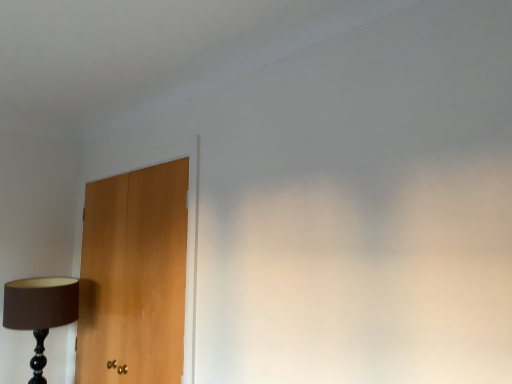
This screenshot has width=512, height=384. I want to click on light brown wood door at left, so click(x=134, y=276).

The width and height of the screenshot is (512, 384). What do you see at coordinates (134, 276) in the screenshot?
I see `light brown wood door at left` at bounding box center [134, 276].

Identify the location of matte black lamp at left. This screenshot has height=384, width=512. (40, 311).

Describe the element at coordinates (40, 311) in the screenshot. This screenshot has width=512, height=384. I see `matte black lamp at left` at that location.

Where is `light brown wood door at left`? This screenshot has width=512, height=384. light brown wood door at left is located at coordinates (134, 276).

Considering the positions of objects matte black lamp at left and light brown wood door at left in the image provided, who is more to the left, matte black lamp at left or light brown wood door at left?

matte black lamp at left.

Considering their positions, is matte black lamp at left located in front of or behind light brown wood door at left?

matte black lamp at left is behind light brown wood door at left.

Between point (33, 370) and point (174, 271), which one is positioned behind?

The point (33, 370) is behind.

From the image's perspective, is matte black lamp at left above or below light brown wood door at left?

matte black lamp at left is situated lower than light brown wood door at left in the image.

From a real-world perspective, who is located higher, matte black lamp at left or light brown wood door at left?

From a 3D spatial view, light brown wood door at left is above.

Considering the relative sizes of matte black lamp at left and light brown wood door at left in the image provided, is matte black lamp at left wider than light brown wood door at left?

Yes, matte black lamp at left is wider than light brown wood door at left.

From the picture: Who is taller, matte black lamp at left or light brown wood door at left?

Standing taller between the two is light brown wood door at left.

In the scene shown: Is matte black lamp at left bigger than light brown wood door at left?

No, matte black lamp at left is not bigger than light brown wood door at left.

Is matte black lamp at left spatially inside light brown wood door at left, or outside of it?

matte black lamp at left is not enclosed by light brown wood door at left.

Are matte black lamp at left and light brown wood door at left located far from each other?

Actually, matte black lamp at left and light brown wood door at left are a little close together.

Is matte black lamp at left facing towards light brown wood door at left?

No, matte black lamp at left is not facing towards light brown wood door at left.

What's the angular difference between matte black lamp at left and light brown wood door at left's facing directions?

90.1 degrees separate the facing orientations of matte black lamp at left and light brown wood door at left.

Where is `lamp below the light brown wood door at left (from the image's perspective)`? lamp below the light brown wood door at left (from the image's perspective) is located at coordinates (40, 311).

In the image, is light brown wood door at left on the left side or the right side of matte black lamp at left?

Based on their positions, light brown wood door at left is located to the right of matte black lamp at left.

Is light brown wood door at left further to the viewer compared to matte black lamp at left?

No, it is not.

Does point (113, 186) come closer to viewer compared to point (55, 292)?

No, it is not.

From the image's perspective, does light brown wood door at left appear higher than matte black lamp at left?

Yes, from the image's perspective, light brown wood door at left is over matte black lamp at left.

From a real-world perspective, who is located lower, light brown wood door at left or matte black lamp at left?

matte black lamp at left, from a real-world perspective.

Considering the sizes of objects light brown wood door at left and matte black lamp at left in the image provided, who is thinner, light brown wood door at left or matte black lamp at left?

light brown wood door at left.

Which of these two, light brown wood door at left or matte black lamp at left, stands shorter?

matte black lamp at left is shorter.

Looking at this image, can you confirm if light brown wood door at left is smaller than matte black lamp at left?

Actually, light brown wood door at left might be larger than matte black lamp at left.

Looking at this image, would you say light brown wood door at left contains matte black lamp at left?

Definitely not — matte black lamp at left is not inside light brown wood door at left.

Can you see light brown wood door at left touching matte black lamp at left?

light brown wood door at left and matte black lamp at left are clearly separated.

Consider the image. Is light brown wood door at left facing away from matte black lamp at left?

Yes, light brown wood door at left's orientation is away from matte black lamp at left.

I want to click on door above the matte black lamp at left (from a real-world perspective), so click(x=134, y=276).

Locate an element on the screen. Image resolution: width=512 pixels, height=384 pixels. door in front of the matte black lamp at left is located at coordinates (134, 276).

The width and height of the screenshot is (512, 384). Find the location of `door above the matte black lamp at left (from a real-world perspective)`. door above the matte black lamp at left (from a real-world perspective) is located at coordinates (134, 276).